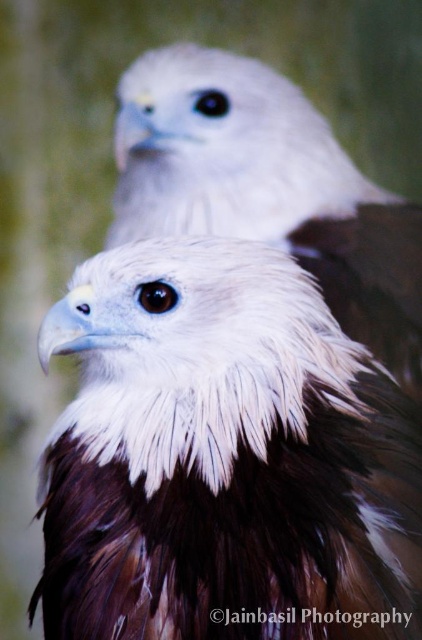
Question: Is white feathered eagle at center to the left of white fluffy eagle at upper center from the viewer's perspective?

Choices:
 (A) yes
 (B) no

Answer: (A)

Question: In this image, where is white feathered eagle at center located relative to white fluffy eagle at upper center?

Choices:
 (A) below
 (B) above

Answer: (A)

Question: Can you confirm if white feathered eagle at center is positioned below white fluffy eagle at upper center?

Choices:
 (A) no
 (B) yes

Answer: (B)

Question: Which object is closer to the camera taking this photo?

Choices:
 (A) white fluffy eagle at upper center
 (B) white feathered eagle at center

Answer: (B)